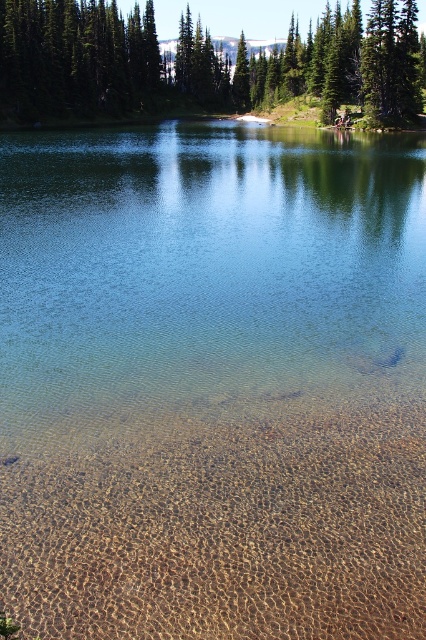
Does point (14, 102) come behind point (371, 17)?

Yes, it is behind point (371, 17).

Does green textured tree at upper center appear on the left side of green matte tree at upper center?

Yes, green textured tree at upper center is to the left of green matte tree at upper center.

Is point (380, 44) farther from viewer compared to point (282, 49)?

No, it is in front of (282, 49).

Find the location of a particular element. This screenshot has width=426, height=640. green textured tree at upper center is located at coordinates (201, 61).

Is clear water at center positioned in front of green textured tree at upper center?

Yes, it is in front of green textured tree at upper center.

From the picture: Can you confirm if clear water at center is smaller than green textured tree at upper center?

Yes, clear water at center is smaller than green textured tree at upper center.

Which is in front, point (264, 164) or point (247, 72)?

Point (264, 164)

You are a GUI agent. You are given a task and a screenshot of the screen. Output one action in this format:
    pyautogui.click(x=<x>, y=<y>)
    Task: Click on the clear water at center
    
    Given the screenshot: What is the action you would take?
    pyautogui.click(x=204, y=275)

Which is above, clear water at center or clear sand at bottom?

Positioned higher is clear water at center.

Does point (169, 124) come closer to viewer compared to point (198, 467)?

That is False.

At what (x,y) coordinates should I click in order to perform the action: click on clear water at center. Please return your answer as a coordinate pair (x, y). This screenshot has height=640, width=426. Looking at the image, I should click on (204, 275).